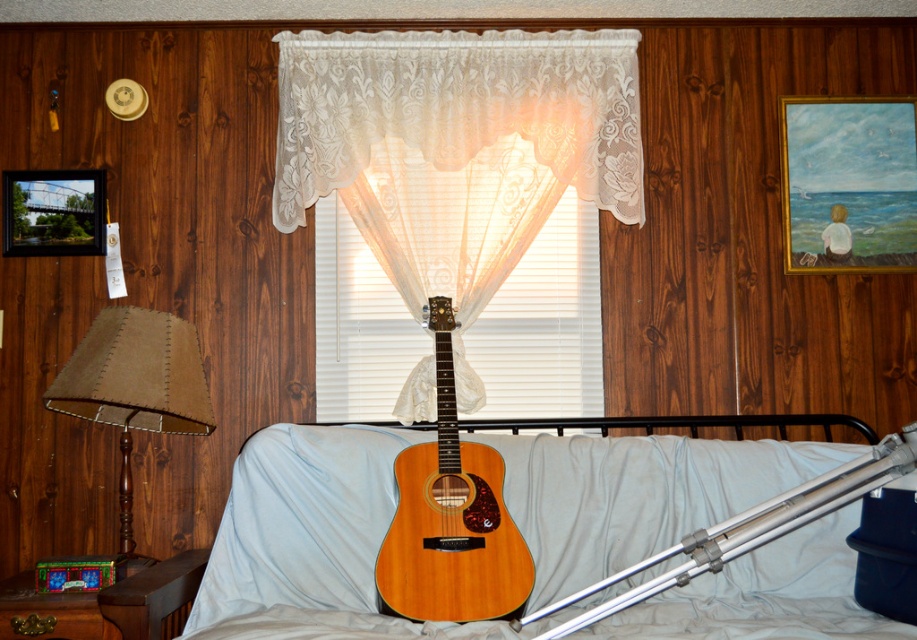
Question: Is natural wood acoustic guitar at center smaller than brown fabric lampshade at left?

Choices:
 (A) yes
 (B) no

Answer: (B)

Question: Which point is closer to the camera?

Choices:
 (A) white lace curtain at center
 (B) wooden bed at center
 (C) silver metallic tripod at lower right

Answer: (C)

Question: Does wooden framed painting of child at upper right lie in front of brown fabric lampshade at left?

Choices:
 (A) no
 (B) yes

Answer: (A)

Question: Which object appears closest to the camera in this image?

Choices:
 (A) wooden bed at center
 (B) white lace curtain at center
 (C) wooden framed painting of child at upper right

Answer: (A)

Question: Is wooden bed at center to the right of metallic silver picture frame at upper left from the viewer's perspective?

Choices:
 (A) no
 (B) yes

Answer: (B)

Question: Which object is closer to the camera taking this photo?

Choices:
 (A) natural wood acoustic guitar at center
 (B) white lace curtain at center
 (C) wooden bed at center
 (D) metallic silver picture frame at upper left

Answer: (C)